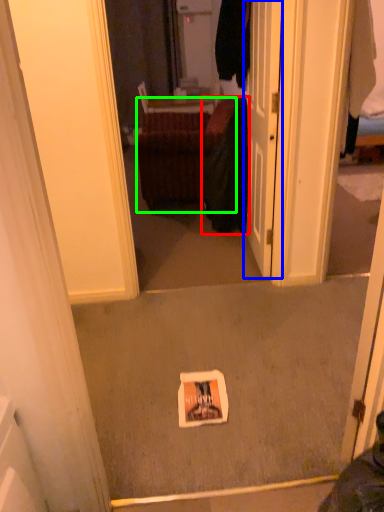
Question: Based on their relative distances, which object is farther from clothing (highlighted by a red box)? Choose from door (highlighted by a blue box) and furniture (highlighted by a green box).

Choices:
 (A) door
 (B) furniture

Answer: (A)